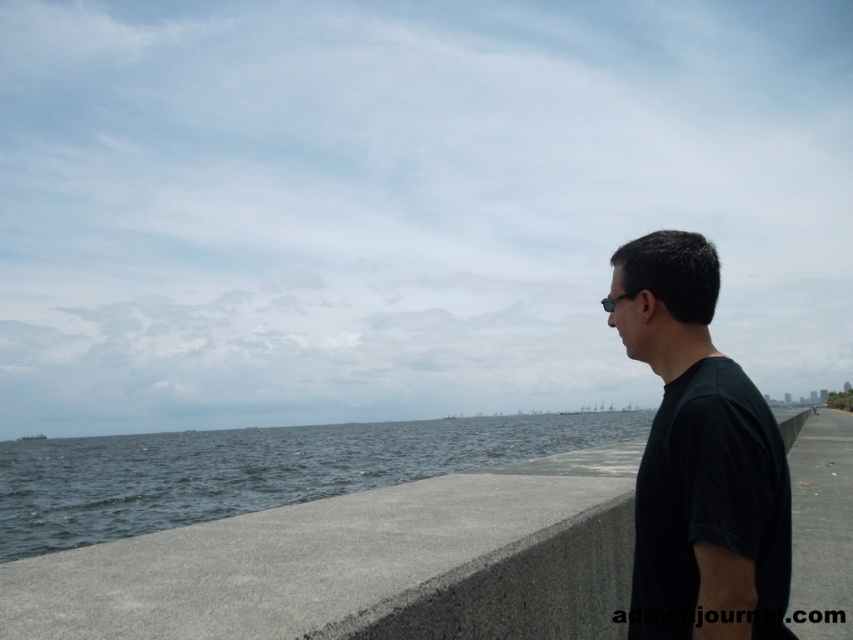
Can you confirm if gray concrete ledge at center is positioned below black matte shirt at right?

Yes, gray concrete ledge at center is below black matte shirt at right.

Consider the image. Can you confirm if gray concrete ledge at center is positioned to the right of black matte shirt at right?

Indeed, gray concrete ledge at center is positioned on the right side of black matte shirt at right.

What do you see at coordinates (361, 564) in the screenshot? I see `gray concrete ledge at center` at bounding box center [361, 564].

The height and width of the screenshot is (640, 853). I want to click on gray concrete ledge at center, so click(x=361, y=564).